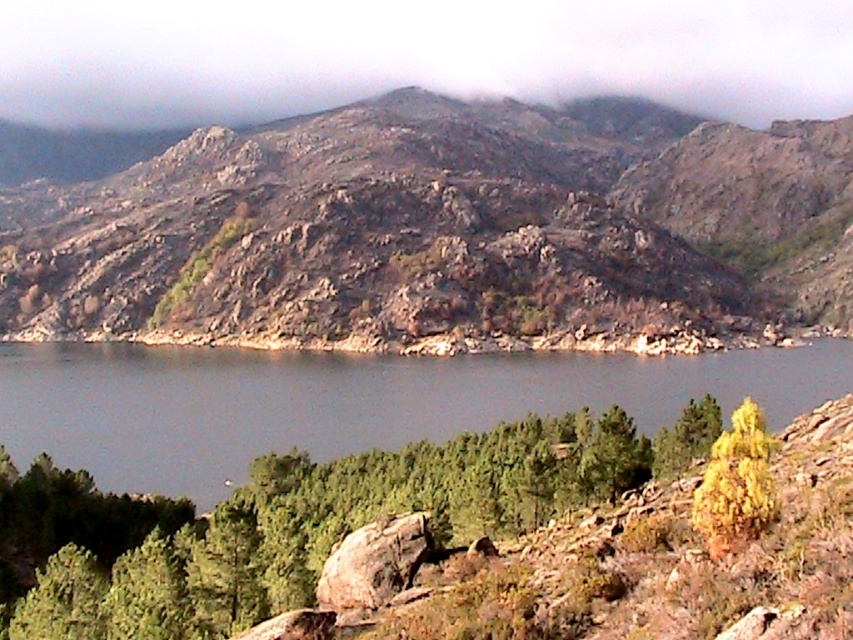
Question: Does rugged stone mountain at upper center appear on the right side of green textured rock at center?

Choices:
 (A) no
 (B) yes

Answer: (A)

Question: From the image, what is the correct spatial relationship of rugged stone mountain at upper center in relation to gray smooth water at center?

Choices:
 (A) left
 (B) right

Answer: (A)

Question: Among these objects, which one is farthest from the camera?

Choices:
 (A) green textured rock at center
 (B) rugged stone mountain at upper center

Answer: (B)

Question: Which of the following is the farthest from the observer?

Choices:
 (A) (827, 321)
 (B) (102, 428)
 (C) (663, 448)
 (D) (735, 449)

Answer: (A)

Question: Which of the following is the farthest from the observer?

Choices:
 (A) yellow-green leafy bush at center-right
 (B) rugged stone mountain at upper center
 (C) rusty rock at center
 (D) green textured rock at center

Answer: (B)

Question: Can you confirm if rugged stone mountain at upper center is positioned to the left of gray smooth water at center?

Choices:
 (A) yes
 (B) no

Answer: (A)